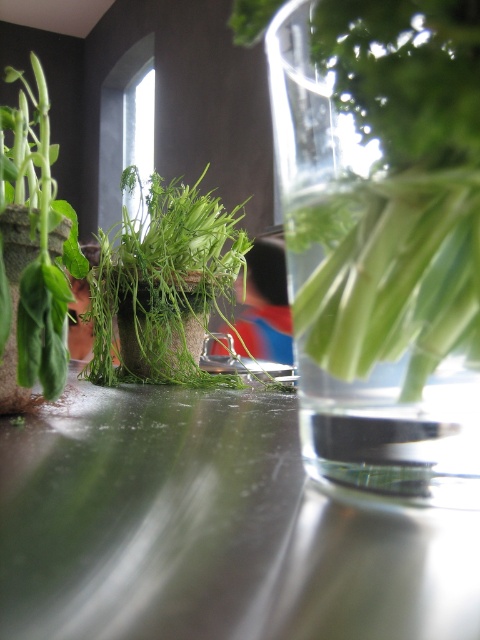
Who is positioned more to the left, shiny metallic table at center or green matte plant at left?

From the viewer's perspective, green matte plant at left appears more on the left side.

Who is positioned more to the right, shiny metallic table at center or green matte plant at left?

From the viewer's perspective, shiny metallic table at center appears more on the right side.

Is point (75, 394) positioned in front of point (2, 284)?

No, (75, 394) is further to viewer.

Locate an element on the screen. This screenshot has height=640, width=480. shiny metallic table at center is located at coordinates (211, 529).

Does green matte plant at left appear over green matte plant pot at left?

Yes.

Is point (57, 282) positioned in front of point (10, 268)?

Yes, it is in front of point (10, 268).

Where is `green matte plant at left`? This screenshot has width=480, height=640. green matte plant at left is located at coordinates (32, 241).

Image resolution: width=480 pixels, height=640 pixels. In order to click on green matte plant at left in this screenshot , I will do `click(32, 241)`.

Can you confirm if shiny metallic table at center is positioned to the right of green matte plant pot at left?

Yes, shiny metallic table at center is to the right of green matte plant pot at left.

Can you confirm if shiny metallic table at center is taller than green matte plant pot at left?

In fact, shiny metallic table at center may be shorter than green matte plant pot at left.

Which is in front, point (321, 529) or point (21, 237)?

Positioned in front is point (321, 529).

The width and height of the screenshot is (480, 640). I want to click on shiny metallic table at center, so click(x=211, y=529).